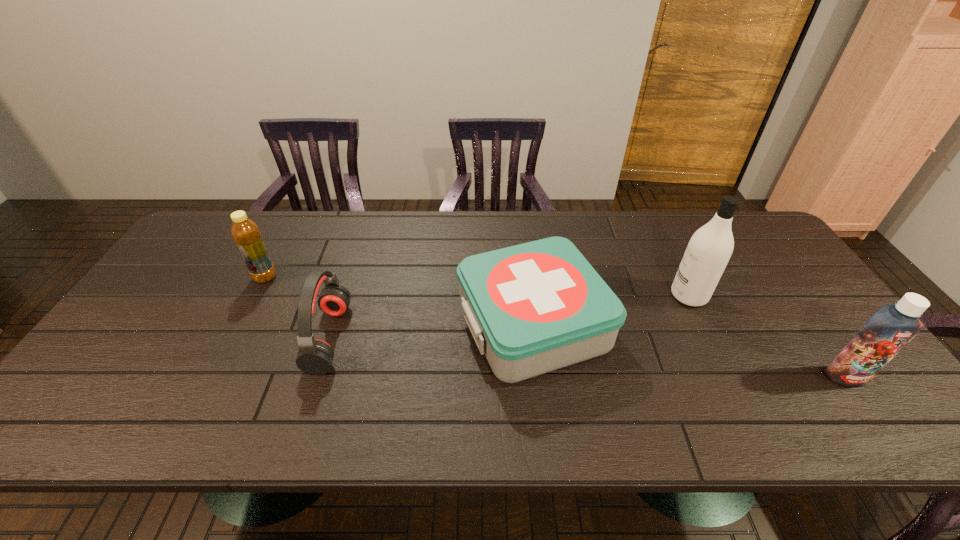
I want to click on vacant space located on the front-facing side of the tallest object, so click(x=596, y=295).

Where is `free location located on the front-facing side of the tallest object`? free location located on the front-facing side of the tallest object is located at coordinates (638, 295).

The image size is (960, 540). Identify the location of free space located on the front label of the rightmost object. (871, 411).

Identify the location of blank space located 0.210m on the left of the bottle. (182, 277).

What are the coordinates of `vacant position located on the ear cups of the earphone` in the screenshot? It's located at (422, 338).

This screenshot has width=960, height=540. I want to click on free space located on the right of the first-aid kit, so click(x=670, y=324).

What are the coordinates of `object located at the right edge` in the screenshot? It's located at (891, 327).

In the image, there is a desktop. Identify the location of vacant region at the far edge. (354, 246).

Where is `blank space at the near edge of the desktop`? blank space at the near edge of the desktop is located at coordinates (756, 433).

The height and width of the screenshot is (540, 960). I want to click on vacant space at the right edge, so click(x=779, y=301).